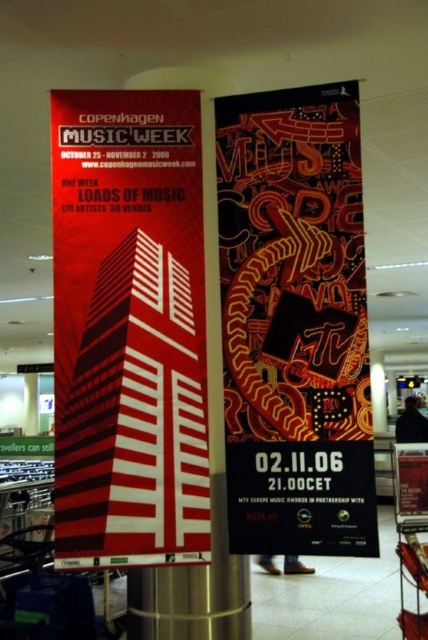
Consider the image. You are standing in a room with a matte red building at center and a matte black poster at center. Which object is positioned to the left?

The matte red building at center is to the left of the matte black poster at center.

You are an event planner standing at the center of the venue. You need to place a 12 inch wide decorative arch between the matte red building at center and the matte black poster at center. Can the arch fit between them without overlapping either object?

The distance between the matte red building at center and the matte black poster at center is 14.70 inches. Since the arch is 12 inches wide, there is enough space to place it between them without overlapping either object.

You are standing in front of two banners and notice two points marked on them. The first point is at coordinates point (142, 374) and the second point is at point (294, 547). Which point is closer to you?

Point (142, 374) is in front of point (294, 547), so it is closer to you.